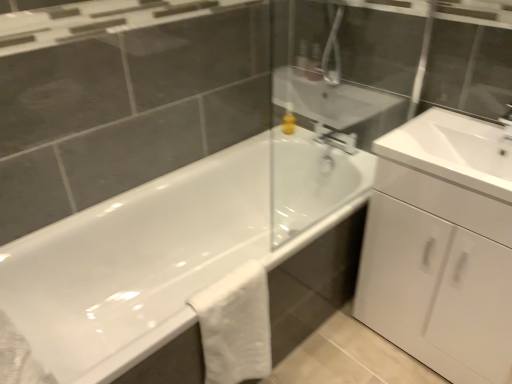
Question: Considering the relative sizes of white glossy bathtub at center and yellow matte soap dispenser at upper center in the image provided, is white glossy bathtub at center thinner than yellow matte soap dispenser at upper center?

Choices:
 (A) yes
 (B) no

Answer: (B)

Question: Is white glossy bathtub at center not within yellow matte soap dispenser at upper center?

Choices:
 (A) yes
 (B) no

Answer: (A)

Question: Is white glossy bathtub at center touching yellow matte soap dispenser at upper center?

Choices:
 (A) yes
 (B) no

Answer: (B)

Question: Considering the relative positions of white glossy bathtub at center and yellow matte soap dispenser at upper center in the image provided, is white glossy bathtub at center to the right of yellow matte soap dispenser at upper center from the viewer's perspective?

Choices:
 (A) yes
 (B) no

Answer: (B)

Question: Does white glossy bathtub at center have a larger size compared to yellow matte soap dispenser at upper center?

Choices:
 (A) yes
 (B) no

Answer: (A)

Question: From a real-world perspective, is white glossy bathtub at center over yellow matte soap dispenser at upper center?

Choices:
 (A) yes
 (B) no

Answer: (B)

Question: From a real-world perspective, is white cotton towel at lower center beneath yellow matte soap dispenser at upper center?

Choices:
 (A) no
 (B) yes

Answer: (B)

Question: Is white cotton towel at lower center outside yellow matte soap dispenser at upper center?

Choices:
 (A) yes
 (B) no

Answer: (A)

Question: Considering the relative sizes of white cotton towel at lower center and yellow matte soap dispenser at upper center in the image provided, is white cotton towel at lower center wider than yellow matte soap dispenser at upper center?

Choices:
 (A) yes
 (B) no

Answer: (A)

Question: Is the depth of white cotton towel at lower center less than that of yellow matte soap dispenser at upper center?

Choices:
 (A) no
 (B) yes

Answer: (B)

Question: Does white cotton towel at lower center lie behind yellow matte soap dispenser at upper center?

Choices:
 (A) no
 (B) yes

Answer: (A)

Question: Is white cotton towel at lower center taller than yellow matte soap dispenser at upper center?

Choices:
 (A) no
 (B) yes

Answer: (B)

Question: Considering the relative sizes of white glossy cabinet at right and yellow matte soap dispenser at upper center in the image provided, is white glossy cabinet at right shorter than yellow matte soap dispenser at upper center?

Choices:
 (A) yes
 (B) no

Answer: (B)